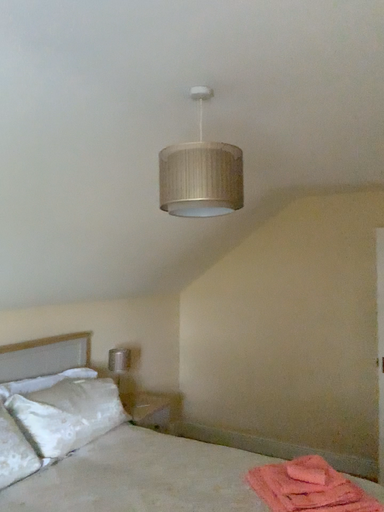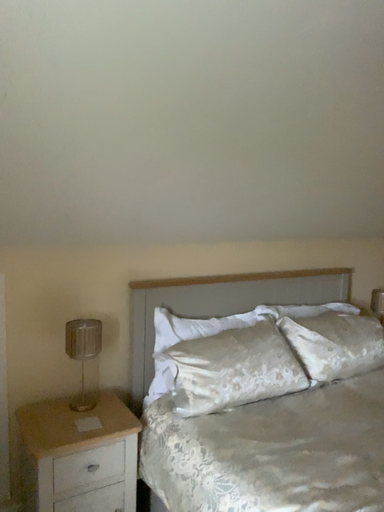
Question: How did the camera likely rotate when shooting the video?

Choices:
 (A) rotated left
 (B) rotated right

Answer: (A)